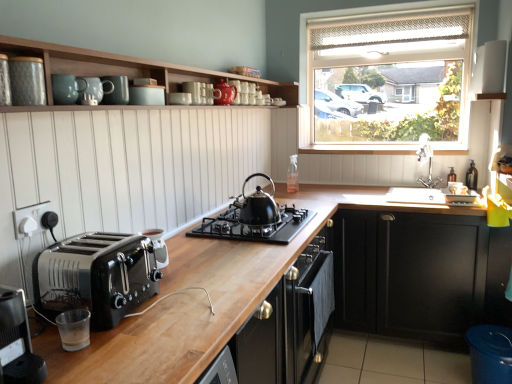
What are the coordinates of `white glossy microwave at upper right, which ranks as the 8th appliance in left-to-right order` in the screenshot? It's located at (489, 72).

The height and width of the screenshot is (384, 512). In order to click on matte ceramic canister at upper center, the fifth appliance from the right in this screenshot , I will do `click(146, 95)`.

How much space does matte ceramic mugs at upper center, acting as the seventh appliance starting from the right, occupy horizontally?

It is 10.68 centimeters.

Measure the distance between matte ceramic mug at upper center, which is the third appliance from left to right, and camera.

matte ceramic mug at upper center, which is the third appliance from left to right, and camera are 1.49 meters apart.

What is the approximate height of matte ceramic mug at upper center, which ranks as the 3th appliance in front-to-back order?

4.16 inches.

In order to click on white glossy microwave at upper right, the first appliance in the top-to-bottom sequence in this screenshot , I will do `click(489, 72)`.

Which object is closer to the camera, wooden at left or wooden at upper center?

wooden at left.

Is wooden at upper center at the back of wooden at left?

No, wooden at left is not facing away from wooden at upper center.

Is wooden at left far from wooden at upper center?

wooden at left is positioned a significant distance from wooden at upper center.

Locate an element on the screen. countertop below the wooden at upper center (from the image's perspective) is located at coordinates (184, 311).

Is brushed metal knob at lower left, which is counted as the 1th knob, starting from the right, bigger or smaller than black metallic toaster at lower left, marked as the 4th appliance in a front-to-back arrangement?

brushed metal knob at lower left, which is counted as the 1th knob, starting from the right, is smaller than black metallic toaster at lower left, marked as the 4th appliance in a front-to-back arrangement.

From their relative heights in the image, would you say brushed metal knob at lower left, arranged as the first knob when viewed from the back, is taller or shorter than black metallic toaster at lower left, which is the fifth appliance in back-to-front order?

Clearly, brushed metal knob at lower left, arranged as the first knob when viewed from the back, is shorter compared to black metallic toaster at lower left, which is the fifth appliance in back-to-front order.

Considering the relative positions of brushed metal knob at lower left, the second knob in the left-to-right sequence, and black metallic toaster at lower left, which is the fifth appliance in back-to-front order, in the image provided, is brushed metal knob at lower left, the second knob in the left-to-right sequence, to the left or to the right of black metallic toaster at lower left, which is the fifth appliance in back-to-front order,?

brushed metal knob at lower left, the second knob in the left-to-right sequence, is to the left of black metallic toaster at lower left, which is the fifth appliance in back-to-front order.

Can you tell me how much brushed metal knob at lower left, arranged as the first knob when viewed from the back, and matte ceramic canister at upper left, the 2th appliance in the bottom-to-top sequence, differ in facing direction?

5.27 degrees.

Does brushed metal knob at lower left, the second knob in the left-to-right sequence, have a larger size compared to matte ceramic canister at upper left, the 1th appliance viewed from the front?

No.

Which of these two, brushed metal knob at lower left, the 2th knob from the front, or matte ceramic canister at upper left, the 2th appliance in the bottom-to-top sequence, stands shorter?

brushed metal knob at lower left, the 2th knob from the front.

From the image's perspective, which is below, matte ceramic mug at upper center, the 4th appliance positioned from the bottom, or glossy ceramic mugs at upper center, acting as the 2th appliance starting from the top?

matte ceramic mug at upper center, the 4th appliance positioned from the bottom, from the image's perspective.

Can you confirm if matte ceramic mug at upper center, which ranks as the 3th appliance in front-to-back order, is bigger than glossy ceramic mugs at upper center, positioned as the second appliance in right-to-left order?

No, matte ceramic mug at upper center, which ranks as the 3th appliance in front-to-back order, is not bigger than glossy ceramic mugs at upper center, positioned as the second appliance in right-to-left order.

Consider the image. Do you think matte ceramic mug at upper center, which is counted as the fifth appliance, starting from the top, is within glossy ceramic mugs at upper center, the seventh appliance in the bottom-to-top sequence, or outside of it?

matte ceramic mug at upper center, which is counted as the fifth appliance, starting from the top, exists outside the volume of glossy ceramic mugs at upper center, the seventh appliance in the bottom-to-top sequence.

Could you measure the distance between matte ceramic mug at upper center, which is counted as the fifth appliance, starting from the top, and glossy ceramic mugs at upper center, the seventh appliance positioned from the left?

18.59 inches.

Which is more to the left, matte white bowl at upper center, which ranks as the 3th appliance in right-to-left order, or matte ceramic mugs at upper center, the sixth appliance in the top-to-bottom sequence?

matte ceramic mugs at upper center, the sixth appliance in the top-to-bottom sequence, is more to the left.

Is point (173, 103) closer to camera compared to point (101, 83)?

No, it is not.

Where is `the 1st appliance below the matte ceramic mugs at upper center, acting as the third appliance starting from the bottom (from a real-world perspective)`? The image size is (512, 384). the 1st appliance below the matte ceramic mugs at upper center, acting as the third appliance starting from the bottom (from a real-world perspective) is located at coordinates (179, 98).

From the picture: From a real-world perspective, is matte white bowl at upper center, which is the 3th appliance from top to bottom, below matte ceramic mugs at upper center, the sixth appliance in the top-to-bottom sequence?

Yes, from a real-world perspective, matte white bowl at upper center, which is the 3th appliance from top to bottom, is below matte ceramic mugs at upper center, the sixth appliance in the top-to-bottom sequence.

From the picture: Considering the relative positions of black plastic toaster at lower left and matte white bowl at upper center, which ranks as the 3th appliance in right-to-left order, in the image provided, is black plastic toaster at lower left behind matte white bowl at upper center, which ranks as the 3th appliance in right-to-left order,?

No, black plastic toaster at lower left is closer to the viewer.

How different are the orientations of black plastic toaster at lower left and matte white bowl at upper center, arranged as the third appliance when viewed from the back, in degrees?

black plastic toaster at lower left and matte white bowl at upper center, arranged as the third appliance when viewed from the back, are facing 11.5 degrees away from each other.

Looking at this image, could you tell me if black plastic toaster at lower left is turned towards matte white bowl at upper center, arranged as the third appliance when viewed from the back?

No, black plastic toaster at lower left does not turn towards matte white bowl at upper center, arranged as the third appliance when viewed from the back.

From the image's perspective, is brushed metal knob at lower left, the first knob viewed from the left, on top of black matte gas stove at center?

Yes, from the image's perspective, brushed metal knob at lower left, the first knob viewed from the left, is above black matte gas stove at center.

Is the position of brushed metal knob at lower left, which ranks as the second knob in back-to-front order, less distant than that of black matte gas stove at center?

Yes, it is in front of black matte gas stove at center.

Can you see brushed metal knob at lower left, acting as the 1th knob starting from the front, touching black matte gas stove at center?

No.

Find the location of `countertop lying in front of the wooden at upper center`. countertop lying in front of the wooden at upper center is located at coordinates (184, 311).

From the brushed metal knob at lower left, the 2th knob from the front, count 5th appliance to the right and point to it. Please provide its 2D coordinates.

[(158, 246)]

Estimate the real-world distances between objects in this image. Which object is closer to wooden at upper center, black matte gas stove at center or matte ceramic mug at upper center, which ranks as the 3th appliance in front-to-back order?

black matte gas stove at center is positioned closer to the anchor wooden at upper center.

From the picture: Estimate the real-world distances between objects in this image. Which object is closer to metallic black toaster at left, black metallic toaster at lower left, which is the fifth appliance in back-to-front order, or brushed metal knob at lower left, acting as the 1th knob starting from the front?

The object closer to metallic black toaster at left is brushed metal knob at lower left, acting as the 1th knob starting from the front.

Which object lies further to the anchor point black matte cabinet at lower right, which is the first cabinetry from bottom to top, silver metallic faucet at upper right or wooden at upper center?

Among the two, wooden at upper center is located further to black matte cabinet at lower right, which is the first cabinetry from bottom to top.

Which object lies further to the anchor point black matte kettle at center, black plastic toaster at lower left or matte white bowl at upper center, arranged as the third appliance when viewed from the back?

The object further to black matte kettle at center is black plastic toaster at lower left.

Estimate the real-world distances between objects in this image. Which object is closer to wooden at left, black plastic toaster at lower left or brushed metal knob at lower left, which is counted as the 1th knob, starting from the right?

Among the two, black plastic toaster at lower left is located nearer to wooden at left.

When comparing their distances from brushed metal knob at lower left, which is counted as the 1th knob, starting from the right, does black matte cabinet at lower right, which is the first cabinetry from bottom to top, or matte ceramic mug at upper center, which is counted as the fifth appliance, starting from the top, seem further?

black matte cabinet at lower right, which is the first cabinetry from bottom to top, is positioned further to the anchor brushed metal knob at lower left, which is counted as the 1th knob, starting from the right.

Looking at the image, which one is located closer to black matte cabinet at lower right, which ranks as the second cabinetry in left-to-right order, metallic black toaster at left or wooden at left?

wooden at left lies closer to black matte cabinet at lower right, which ranks as the second cabinetry in left-to-right order, than the other object.

When comparing their distances from wooden at upper center, does matte ceramic mugs at upper center, the seventh appliance viewed from the back, or matte white bowl at upper center, which ranks as the 3th appliance in right-to-left order, seem further?

matte ceramic mugs at upper center, the seventh appliance viewed from the back.

This screenshot has width=512, height=384. I want to click on knob between teal ceramic mug at upper center and brushed metal knob at lower left, the first knob viewed from the left, in the up-down direction, so click(49, 220).

Find the location of a particular element. This screenshot has height=384, width=512. appliance that lies between matte ceramic mugs at upper center, acting as the third appliance starting from the bottom, and black metallic toaster at lower left, placed as the 8th appliance when sorted from top to bottom, from top to bottom is located at coordinates (27, 81).

This screenshot has width=512, height=384. In order to click on cabinetry between black matte kettle at center and silver metallic faucet at upper right from left to right in this screenshot , I will do `click(409, 274)`.

Image resolution: width=512 pixels, height=384 pixels. Identify the location of gas stove positioned between wooden at left and black matte kettle at center from near to far. (254, 226).